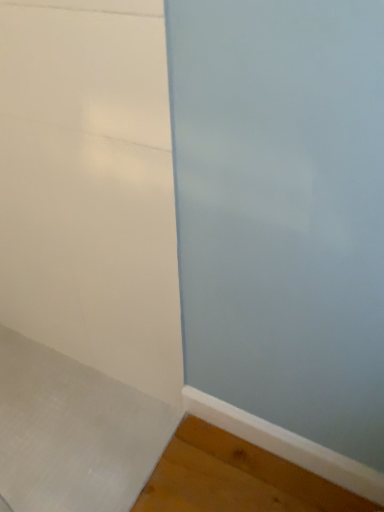
What do you see at coordinates (236, 478) in the screenshot? I see `white matte baseboard at lower right` at bounding box center [236, 478].

Image resolution: width=384 pixels, height=512 pixels. In order to click on white matte baseboard at lower right in this screenshot , I will do `click(236, 478)`.

You are a GUI agent. You are given a task and a screenshot of the screen. Output one action in this format:
    pyautogui.click(x=<x>, y=<y>)
    Task: Click on the white matte baseboard at lower right
    This screenshot has height=512, width=384.
    Given the screenshot: What is the action you would take?
    pyautogui.click(x=236, y=478)